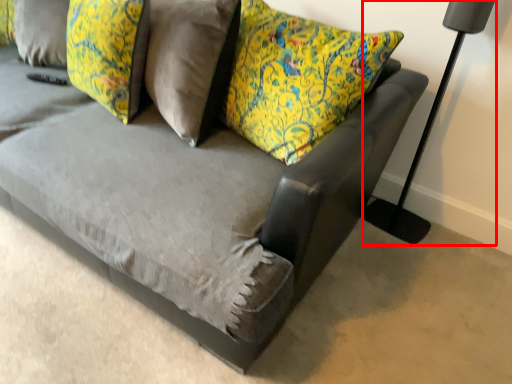
Question: Observing the image, what is the correct spatial positioning of table lamp (annotated by the red box) in reference to pillow?

Choices:
 (A) right
 (B) left

Answer: (A)